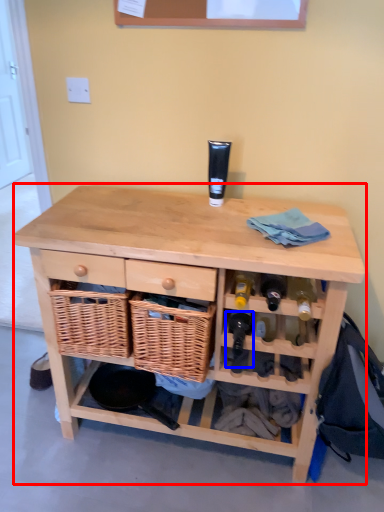
Question: Which of the following is the closest to the observer, table (highlighted by a red box) or wine bottle (highlighted by a blue box)?

Choices:
 (A) table
 (B) wine bottle

Answer: (A)